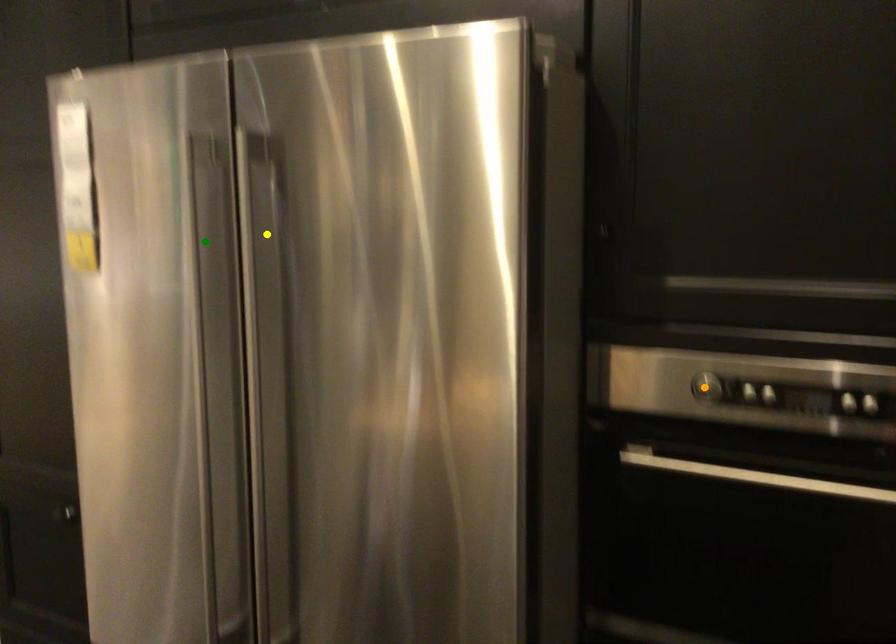
Order these from nearest to farthest:
A) yellow point
B) orange point
C) green point

orange point → yellow point → green point